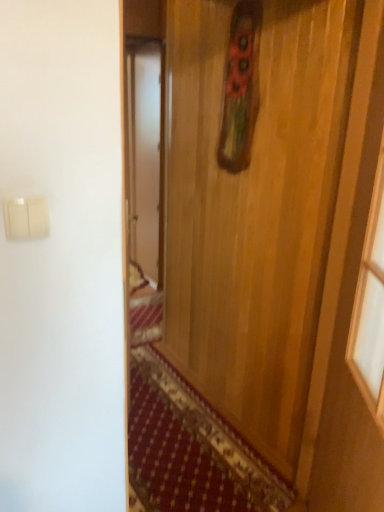
Question: From the image's perspective, relative to wooden door at center, is white plastic light switch at upper left above or below?

Choices:
 (A) below
 (B) above

Answer: (B)

Question: From a real-world perspective, is white plastic light switch at upper left positioned above or below wooden door at center?

Choices:
 (A) below
 (B) above

Answer: (B)

Question: Considering the positions of white plastic light switch at upper left and wooden door at center in the image, is white plastic light switch at upper left bigger or smaller than wooden door at center?

Choices:
 (A) small
 (B) big

Answer: (A)

Question: From the image's perspective, relative to white plastic light switch at upper left, is wooden door at center above or below?

Choices:
 (A) below
 (B) above

Answer: (A)

Question: Visually, is wooden door at center positioned to the left or to the right of white plastic light switch at upper left?

Choices:
 (A) left
 (B) right

Answer: (B)

Question: Would you say wooden door at center is inside or outside white plastic light switch at upper left?

Choices:
 (A) inside
 (B) outside

Answer: (B)

Question: From a real-world perspective, relative to white plastic light switch at upper left, is wooden door at center vertically above or below?

Choices:
 (A) below
 (B) above

Answer: (A)